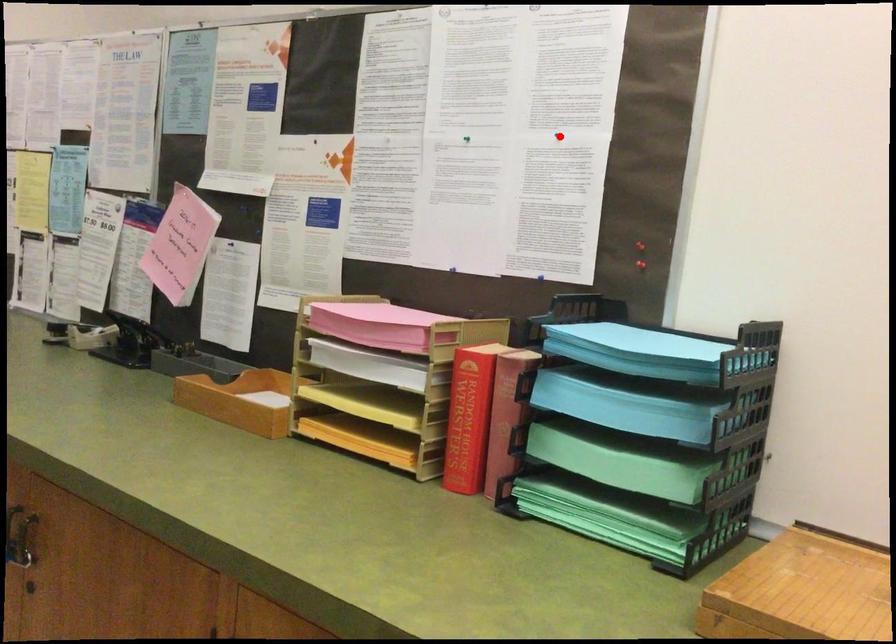
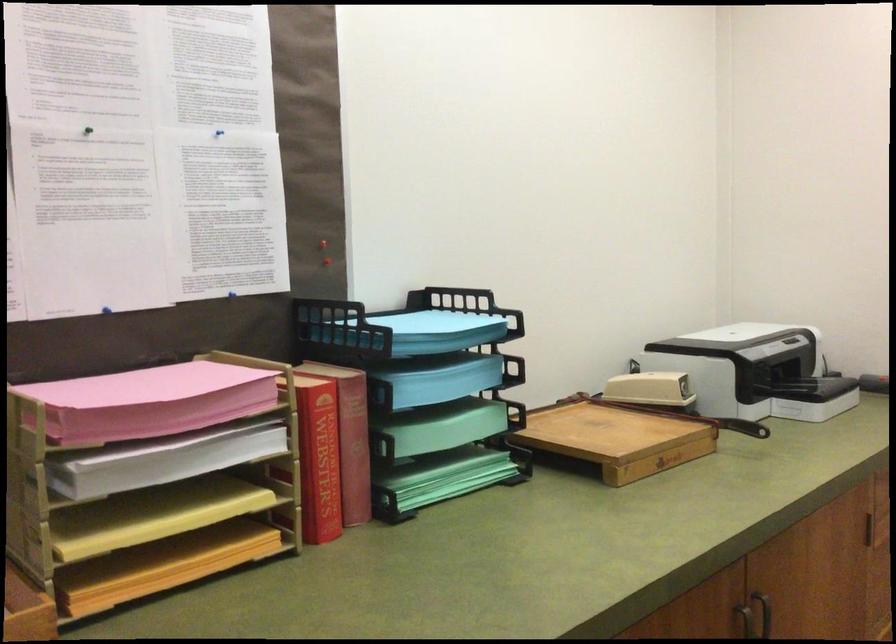
Question: A red point is marked in image1. In image2, is the corresponding 3D point closer to the camera or farther? Reply with the corresponding letter.

Choices:
 (A) The corresponding 3D point is closer.
 (B) The corresponding 3D point is farther.

Answer: (A)